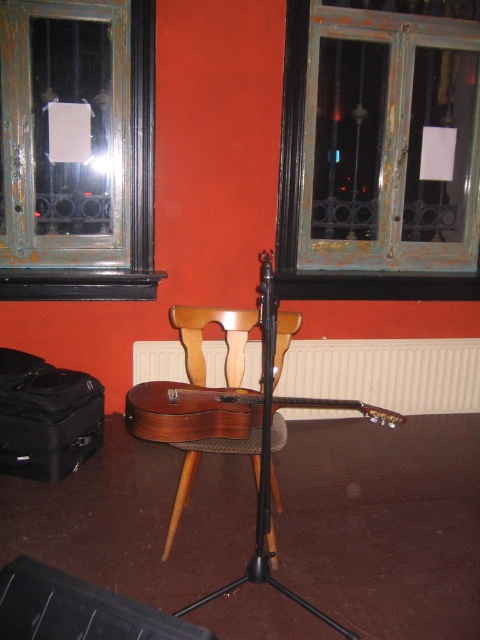
You are setting up a camera on the black matte tripod at center to take a photo of the greenish wooden window at upper center. Can the camera capture the entire window in the frame without moving the tripod?

The greenish wooden window at upper center might be wider than the black matte tripod at center, so there is a possibility that the camera cannot capture the entire window in the frame if the window is wider than the tripod allows the camera to adjust its angle or zoom.

You are an interior designer planning to install new curtains. You need to know which window is bigger to choose the appropriate curtain size. Which window between the greenish wooden window at upper center and the rusty metal window at upper left is larger?

The greenish wooden window at upper center is larger than the rusty metal window at upper left, so you should choose curtains designed for larger windows for that one.

You are setting up a camera on the black matte tripod at center to take a photo of the greenish wooden window at upper center. Since the window is larger than the tripod, will you need to adjust the camera angle to include the entire window in the photo?

The greenish wooden window at upper center is bigger than the black matte tripod at center. To capture the entire window, you might need to adjust the camera angle or move closer to ensure the window fits within the frame.